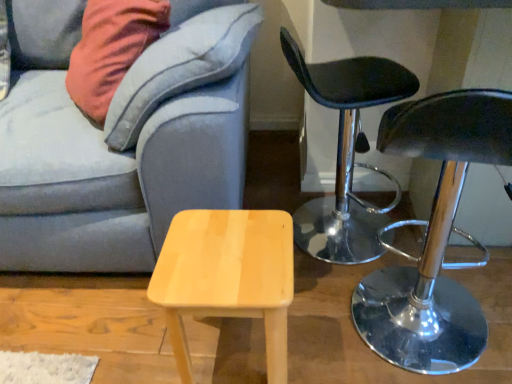
You are a GUI agent. You are given a task and a screenshot of the screen. Output one action in this format:
    pyautogui.click(x=<x>, y=<y>)
    Task: Click on the vacant space to the right of light wood stool at center
    This screenshot has width=512, height=384.
    Given the screenshot: What is the action you would take?
    pyautogui.click(x=331, y=329)